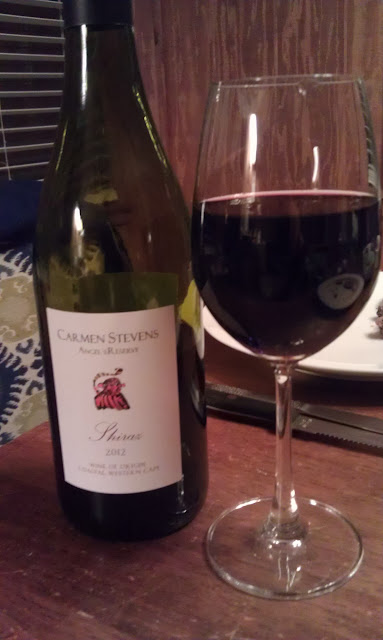
Where is `table`? The height and width of the screenshot is (640, 383). table is located at coordinates (173, 578).